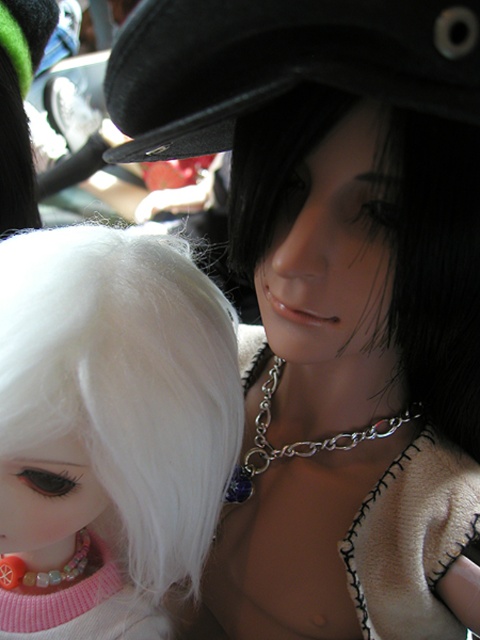
Question: From the image, what is the correct spatial relationship of black leather hat at upper center in relation to multicolored plastic teething ring at lower left?

Choices:
 (A) above
 (B) below

Answer: (A)

Question: In this image, where is black matte hair at center located relative to silver chain at center?

Choices:
 (A) right
 (B) left

Answer: (A)

Question: Estimate the real-world distances between objects in this image. Which object is closer to the black matte hair at center?

Choices:
 (A) white matte wig at left
 (B) multicolored plastic teething ring at lower left
 (C) silver chain at center
 (D) matte pink lips at center

Answer: (D)

Question: Which of the following is the closest to the observer?

Choices:
 (A) multicolored plastic teething ring at lower left
 (B) black leather hat at upper center
 (C) white matte wig at left
 (D) matte pink lips at center

Answer: (B)

Question: Where is black matte hair at center located in relation to silver chain at center in the image?

Choices:
 (A) right
 (B) left

Answer: (A)

Question: Which of the following is the closest to the observer?

Choices:
 (A) (26, 529)
 (B) (252, 467)
 (C) (443, 160)

Answer: (C)